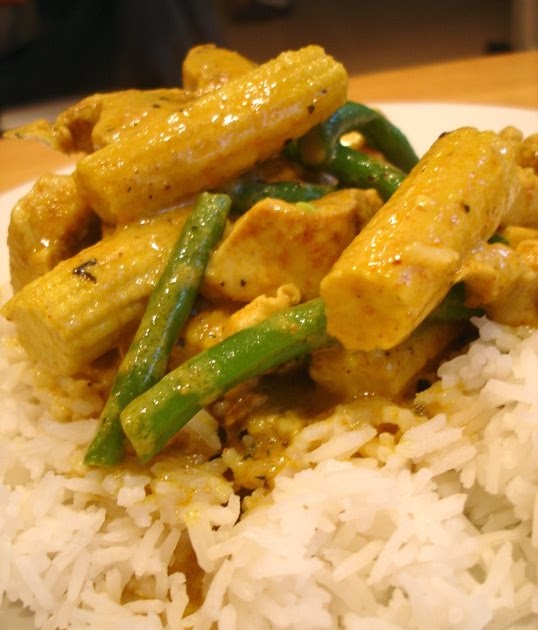
At what (x,y) coordinates should I click in order to perform the action: click on floor. Please return your answer as a coordinate pair (x, y). This screenshot has height=630, width=538. Looking at the image, I should click on (421, 38), (342, 38).